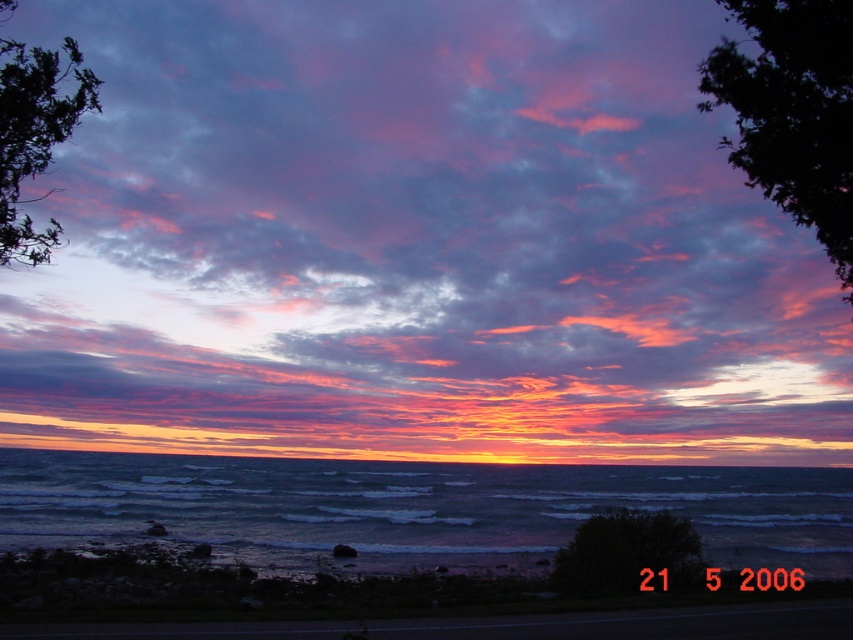
Question: Which of the following is the closest to the observer?

Choices:
 (A) smooth sand shoreline at lower center
 (B) vivid pink cotton clouds at center

Answer: (A)

Question: Can you confirm if vivid pink cotton clouds at center is positioned to the right of smooth sand shoreline at lower center?

Choices:
 (A) no
 (B) yes

Answer: (A)

Question: Can you confirm if vivid pink cotton clouds at center is positioned above teal water at lower center?

Choices:
 (A) no
 (B) yes

Answer: (B)

Question: Which is nearer to the smooth sand shoreline at lower center?

Choices:
 (A) teal water at lower center
 (B) vivid pink cotton clouds at center

Answer: (A)

Question: Which object appears closest to the camera in this image?

Choices:
 (A) vivid pink cotton clouds at center
 (B) smooth sand shoreline at lower center

Answer: (B)

Question: From the image, what is the correct spatial relationship of vivid pink cotton clouds at center in relation to smooth sand shoreline at lower center?

Choices:
 (A) left
 (B) right

Answer: (A)